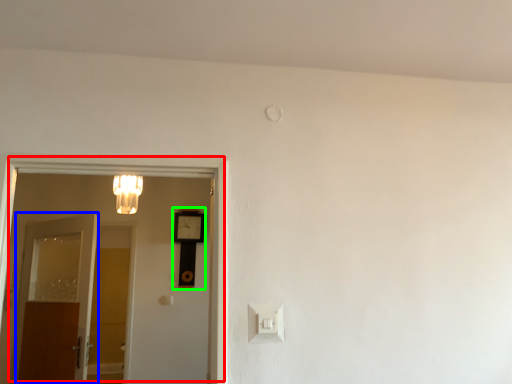
Question: Based on their relative distances, which object is farther from door (highlighted by a red box)? Choose from door (highlighted by a blue box) and clock (highlighted by a green box).

Choices:
 (A) door
 (B) clock

Answer: (B)